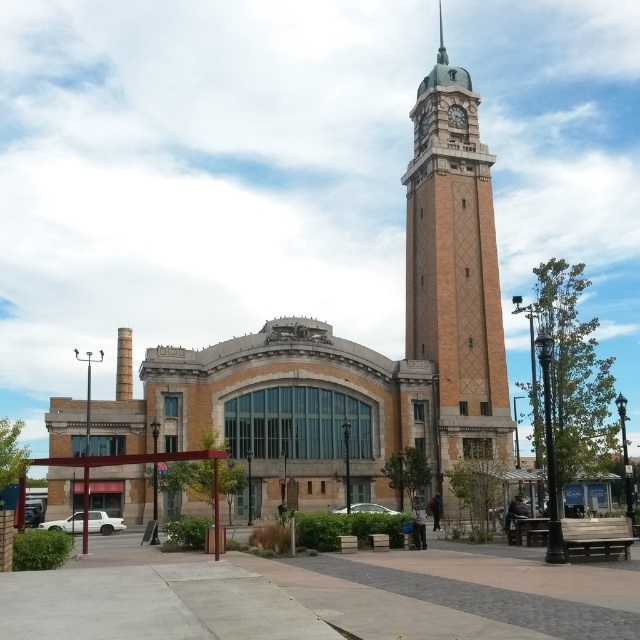
Question: Is brown brick clock tower at upper right to the left of brick clock tower at upper center from the viewer's perspective?

Choices:
 (A) no
 (B) yes

Answer: (B)

Question: Which point appears farthest from the camera in this image?

Choices:
 (A) (410, 301)
 (B) (451, 122)

Answer: (B)

Question: Is brown brick clock tower at upper right further to camera compared to brick clock tower at upper center?

Choices:
 (A) yes
 (B) no

Answer: (B)

Question: Among these points, which one is farthest from the camera?

Choices:
 (A) (452, 125)
 (B) (444, 272)

Answer: (A)

Question: Is brown brick clock tower at upper right to the right of brick clock tower at upper center from the viewer's perspective?

Choices:
 (A) yes
 (B) no

Answer: (B)